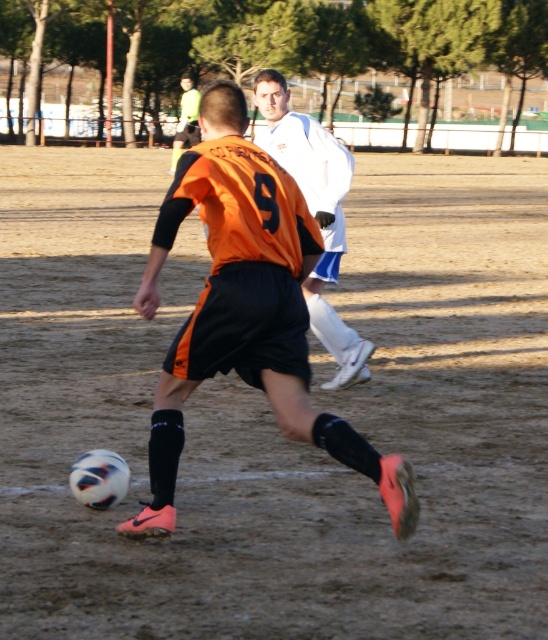
Question: Which object is farther from the camera taking this photo?

Choices:
 (A) orange jersey at center
 (B) white matte jacket at upper center

Answer: (A)

Question: Which point is farther from the camera taking this photo?

Choices:
 (A) (275, 88)
 (B) (182, 83)

Answer: (B)

Question: Observing the image, what is the correct spatial positioning of orange matte jersey at center in reference to white matte jacket at upper center?

Choices:
 (A) below
 (B) above

Answer: (A)

Question: Based on their relative distances, which object is farther from the orange jersey at center?

Choices:
 (A) orange matte jersey at center
 (B) white matte jacket at upper center

Answer: (B)

Question: Does white matte jacket at upper center have a greater width compared to orange jersey at center?

Choices:
 (A) yes
 (B) no

Answer: (B)

Question: Can you confirm if orange matte jersey at center is positioned above orange jersey at center?

Choices:
 (A) yes
 (B) no

Answer: (B)